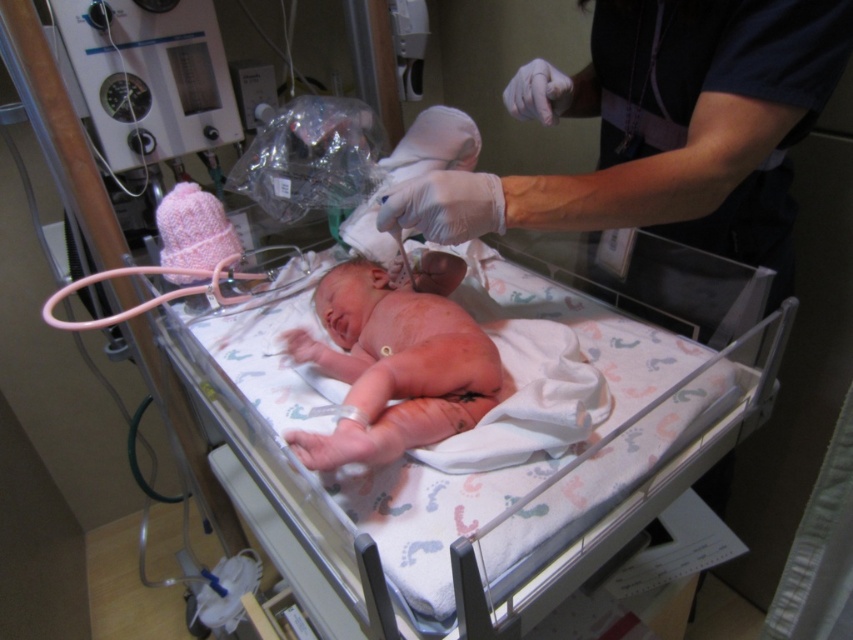
Question: Does white latex gloves at upper center appear on the left side of pink fabric newborn at center?

Choices:
 (A) no
 (B) yes

Answer: (A)

Question: Considering the relative positions of white latex gloves at upper center and pink fabric newborn at center in the image provided, where is white latex gloves at upper center located with respect to pink fabric newborn at center?

Choices:
 (A) left
 (B) right

Answer: (B)

Question: Which object appears closest to the camera in this image?

Choices:
 (A) pink fabric newborn at center
 (B) white latex gloves at upper center

Answer: (A)

Question: Does white latex gloves at upper center appear under pink fabric newborn at center?

Choices:
 (A) yes
 (B) no

Answer: (B)